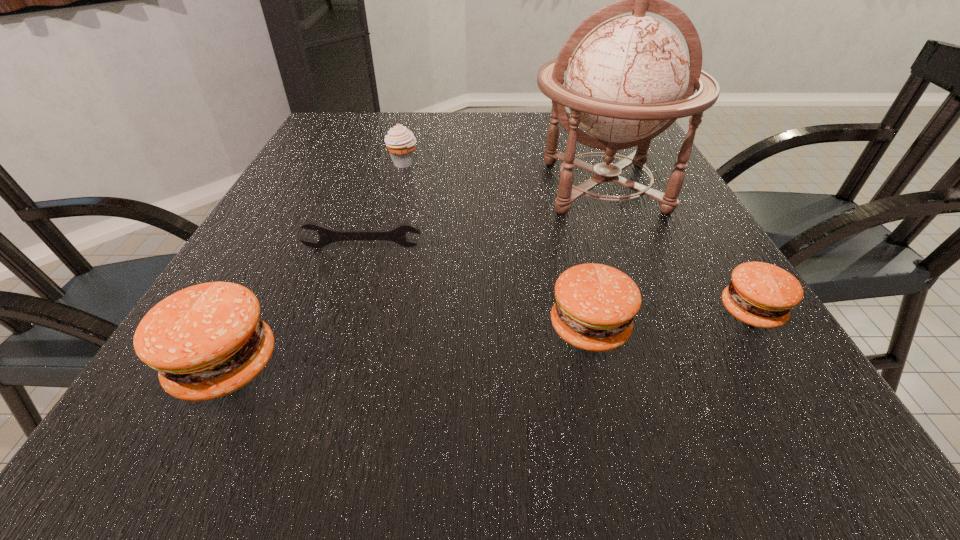
I want to click on vacant area in the image that satisfies the following two spatial constraints: 1. on the open ends of the fourth nearest object; 2. on the left side of the second shortest patty, so coord(337,328).

Where is `vacant region that satisfies the following two spatial constraints: 1. on the open ends of the second shortest patty; 2. on the right side of the wrench`? The height and width of the screenshot is (540, 960). vacant region that satisfies the following two spatial constraints: 1. on the open ends of the second shortest patty; 2. on the right side of the wrench is located at coordinates (337, 328).

Where is `vacant region that satisfies the following two spatial constraints: 1. on the back side of the rightmost patty; 2. on the right side of the second patty from left to right`? The height and width of the screenshot is (540, 960). vacant region that satisfies the following two spatial constraints: 1. on the back side of the rightmost patty; 2. on the right side of the second patty from left to right is located at coordinates (585, 312).

You are a GUI agent. You are given a task and a screenshot of the screen. Output one action in this format:
    pyautogui.click(x=<x>, y=<y>)
    Task: Click on the vacant area in the image that satisfies the following two spatial constraints: 1. on the back side of the second patty from left to right; 2. on the left side of the leftmost patty
    This screenshot has height=540, width=960.
    Given the screenshot: What is the action you would take?
    pyautogui.click(x=245, y=328)